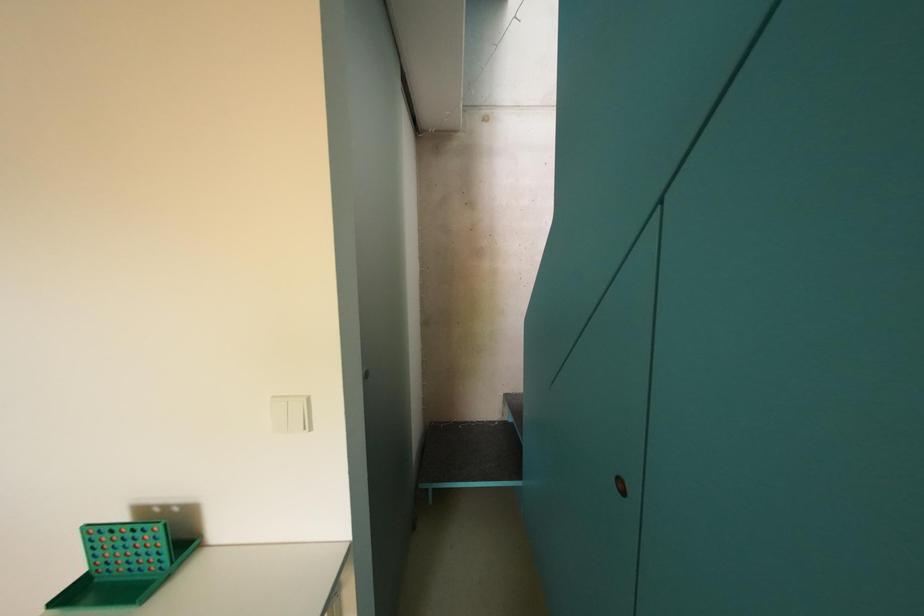
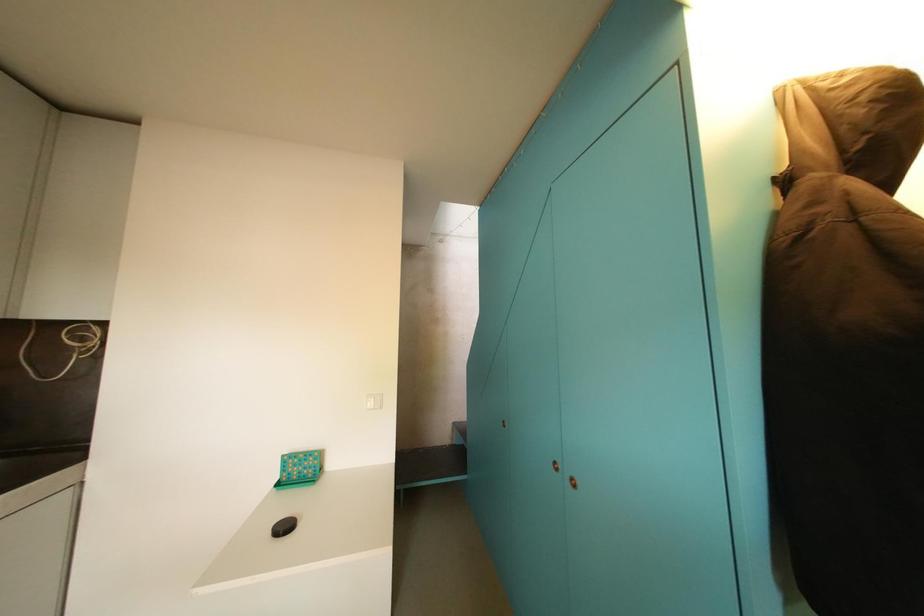
Question: Which direction would the cameraman need to move to produce the second image? Reply with the corresponding letter.

Choices:
 (A) Left
 (B) Right
 (C) Forward
 (D) Backward

Answer: (D)